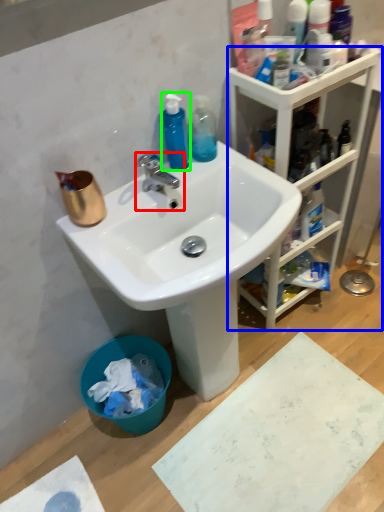
Question: Considering the real-world distances, which object is farthest from tap (highlighted by a red box)? cabinetry (highlighted by a blue box) or cleaning product (highlighted by a green box)?

Choices:
 (A) cabinetry
 (B) cleaning product

Answer: (A)